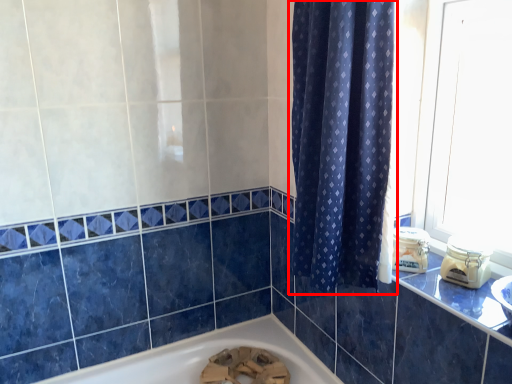
Question: From the image's perspective, where is curtain (annotated by the red box) located relative to counter top?

Choices:
 (A) below
 (B) above

Answer: (B)